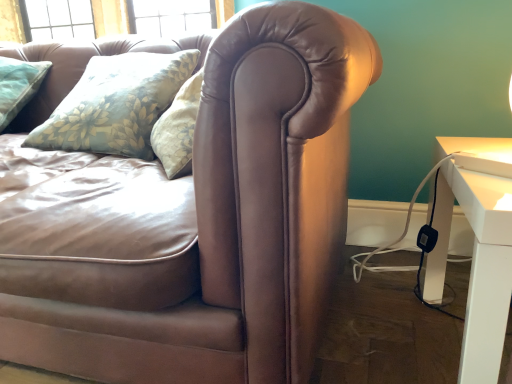
You are a GUI agent. You are given a task and a screenshot of the screen. Output one action in this format:
    pyautogui.click(x=<x>, y=<y>)
    Task: Click on the white glossy table at right
    This screenshot has width=512, height=384.
    Given the screenshot: What is the action you would take?
    pyautogui.click(x=476, y=265)

Describe the element at coordinates (476, 265) in the screenshot. The height and width of the screenshot is (384, 512). I see `white glossy table at right` at that location.

I want to click on brown leather couch at center, so click(215, 217).

This screenshot has height=384, width=512. What do you see at coordinates (215, 217) in the screenshot? I see `brown leather couch at center` at bounding box center [215, 217].

You are a GUI agent. You are given a task and a screenshot of the screen. Output one action in this format:
    pyautogui.click(x=<x>, y=<y>)
    Task: Click on the white glossy table at right
    This screenshot has width=512, height=384.
    Given the screenshot: What is the action you would take?
    pyautogui.click(x=476, y=265)

Is white glossy table at right to the left or to the right of brown leather couch at center in the image?

Clearly, white glossy table at right is on the right of brown leather couch at center in the image.

Is white glossy table at right positioned behind brown leather couch at center?

Yes.

Is point (435, 283) in front of point (297, 236)?

That is False.

From the image's perspective, which is above, white glossy table at right or brown leather couch at center?

brown leather couch at center, from the image's perspective.

From a real-world perspective, who is located lower, white glossy table at right or brown leather couch at center?

white glossy table at right is physically lower.

Which object is thinner, white glossy table at right or brown leather couch at center?

white glossy table at right is thinner.

Considering the sizes of objects white glossy table at right and brown leather couch at center in the image provided, who is taller, white glossy table at right or brown leather couch at center?

With more height is brown leather couch at center.

Based on their sizes in the image, would you say white glossy table at right is bigger or smaller than brown leather couch at center?

white glossy table at right is smaller than brown leather couch at center.

Is white glossy table at right inside or outside of brown leather couch at center?

white glossy table at right cannot be found inside brown leather couch at center.

Are white glossy table at right and brown leather couch at center located far from each other?

No.

Is white glossy table at right looking in the opposite direction of brown leather couch at center?

Absolutely, white glossy table at right is directed away from brown leather couch at center.

The height and width of the screenshot is (384, 512). In order to click on table lying behind the brown leather couch at center in this screenshot , I will do `click(476, 265)`.

Which object is positioned more to the left, brown leather couch at center or white glossy table at right?

brown leather couch at center is more to the left.

Is brown leather couch at center positioned before white glossy table at right?

Yes, it is in front of white glossy table at right.

Between point (288, 23) and point (471, 138), which one is positioned in front?

The point (288, 23) is closer to the camera.

From the image's perspective, is brown leather couch at center beneath white glossy table at right?

Actually, brown leather couch at center appears above white glossy table at right in the image.

From a real-world perspective, is brown leather couch at center physically located above or below white glossy table at right?

In terms of real-world spatial position, brown leather couch at center is above white glossy table at right.

Considering the sizes of objects brown leather couch at center and white glossy table at right in the image provided, who is wider, brown leather couch at center or white glossy table at right?

With larger width is brown leather couch at center.

Who is taller, brown leather couch at center or white glossy table at right?

brown leather couch at center is taller.

Between brown leather couch at center and white glossy table at right, which one has larger size?

brown leather couch at center.

Can we say brown leather couch at center lies outside white glossy table at right?

brown leather couch at center lies outside white glossy table at right's area.

Would you consider brown leather couch at center to be distant from white glossy table at right?

No, there isn't a large distance between brown leather couch at center and white glossy table at right.

Could you tell me if brown leather couch at center is facing white glossy table at right?

No, brown leather couch at center is not facing towards white glossy table at right.

Measure the distance between brown leather couch at center and white glossy table at right.

The distance of brown leather couch at center from white glossy table at right is 14.67 inches.

You are a GUI agent. You are given a task and a screenshot of the screen. Output one action in this format:
    pyautogui.click(x=<x>, y=<y>)
    Task: Click on the studio couch located above the white glossy table at right (from the image's perspective)
    The height and width of the screenshot is (384, 512).
    Given the screenshot: What is the action you would take?
    pyautogui.click(x=215, y=217)

At what (x,y) coordinates should I click in order to perform the action: click on table located below the brown leather couch at center (from the image's perspective). Please return your answer as a coordinate pair (x, y). This screenshot has height=384, width=512. Looking at the image, I should click on (476, 265).

Where is `studio couch on the left of white glossy table at right`? This screenshot has width=512, height=384. studio couch on the left of white glossy table at right is located at coordinates (215, 217).